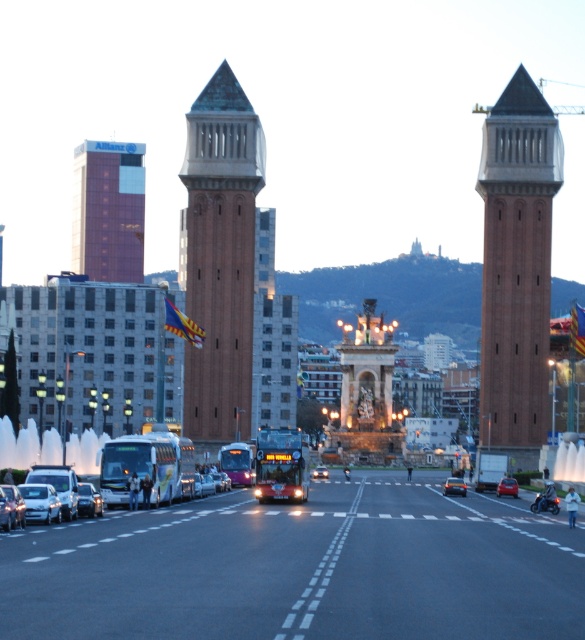
Can you confirm if red brick building at upper left is smaller than metallic silver car at lower left?

No.

Does red brick building at upper left have a greater height compared to metallic silver car at lower left?

Indeed, red brick building at upper left has a greater height compared to metallic silver car at lower left.

You are a GUI agent. You are given a task and a screenshot of the screen. Output one action in this format:
    pyautogui.click(x=<x>, y=<y>)
    Task: Click on the red brick building at upper left
    This screenshot has height=640, width=585.
    Given the screenshot: What is the action you would take?
    pyautogui.click(x=108, y=211)

Can you confirm if brown brick bell tower at right is positioned above shiny black car at center?

Yes, brown brick bell tower at right is above shiny black car at center.

Does brown brick bell tower at right have a greater height compared to shiny black car at center?

Correct, brown brick bell tower at right is much taller as shiny black car at center.

Is point (541, 264) behind point (445, 490)?

Yes, it is behind point (445, 490).

Find the location of `brown brick bell tower at right`. brown brick bell tower at right is located at coordinates (517, 268).

Which of these two, white marble fountain at left or metallic silver car at lower left, stands shorter?

metallic silver car at lower left is shorter.

Is point (22, 429) in front of point (9, 497)?

No, it is behind (9, 497).

Between point (25, 442) and point (22, 518), which one is positioned in front?

Positioned in front is point (22, 518).

At what (x,y) coordinates should I click in order to perform the action: click on white marble fountain at left. Please return your answer as a coordinate pair (x, y). This screenshot has height=640, width=585. Looking at the image, I should click on (27, 445).